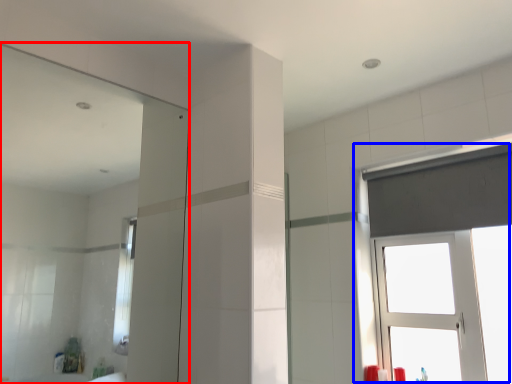
Question: Which point is closer to the camera, mirror (highlighted by a red box) or window (highlighted by a blue box)?

Choices:
 (A) mirror
 (B) window

Answer: (A)